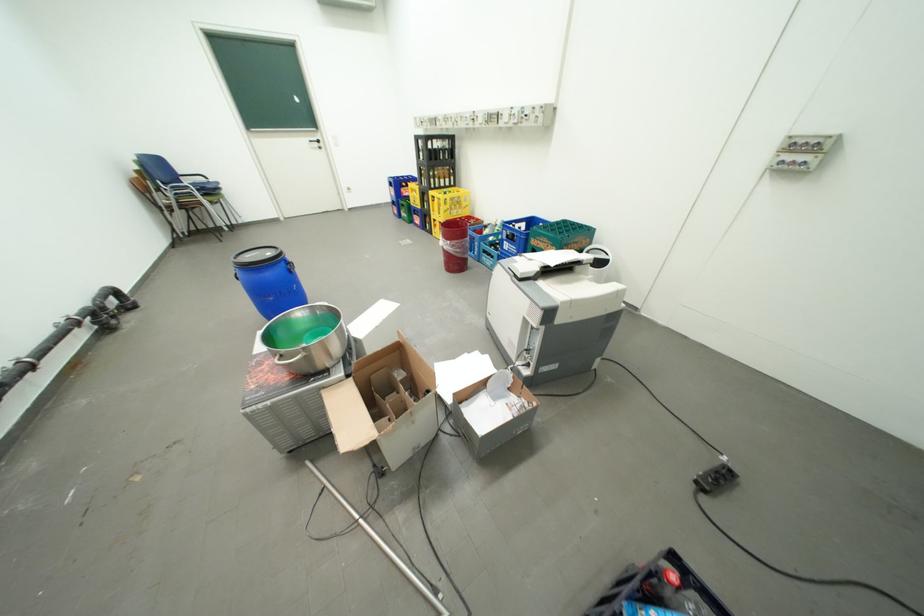
Where is `printer document feeder`? printer document feeder is located at coordinates 529,264.